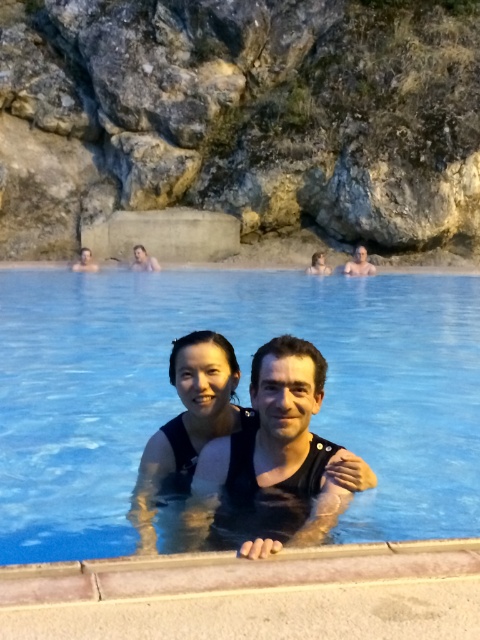
Question: Does clear blue water at center have a smaller size compared to matte black man at upper center?

Choices:
 (A) yes
 (B) no

Answer: (B)

Question: Among these objects, which one is farthest from the camera?

Choices:
 (A) matte black swimsuit at center
 (B) clear blue water at center
 (C) matte black man at upper center

Answer: (C)

Question: Among these points, which one is farthest from the camera?

Choices:
 (A) (278, 474)
 (B) (84, 305)

Answer: (B)

Question: Estimate the real-world distances between objects in this image. Which object is farther from the matte black swimsuit at center?

Choices:
 (A) matte black man at upper center
 (B) matte black man at upper left

Answer: (B)

Question: Does black matte swimsuit at center come in front of matte black man at upper center?

Choices:
 (A) yes
 (B) no

Answer: (A)

Question: Is clear blue water at center smaller than matte black swimsuit at center?

Choices:
 (A) no
 (B) yes

Answer: (A)